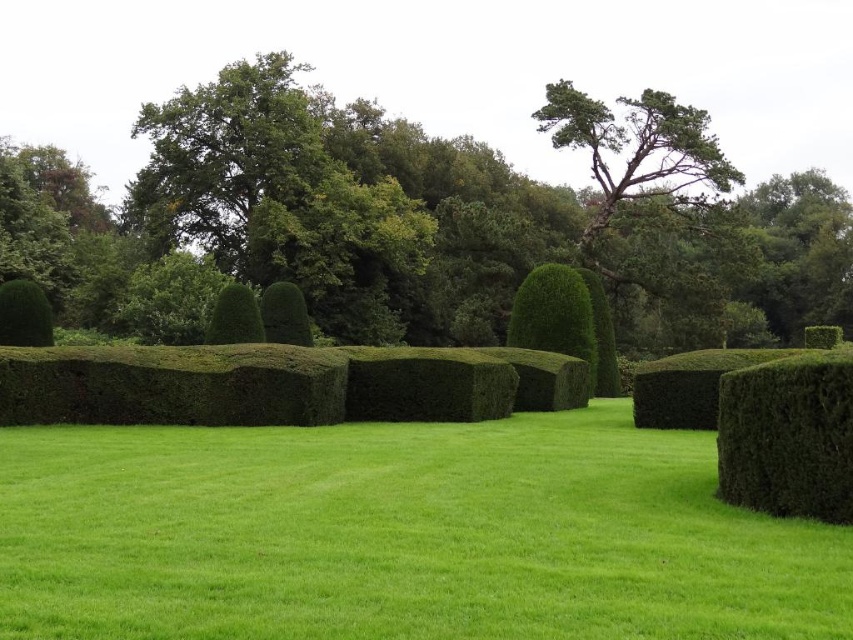
Describe the element at coordinates (399, 228) in the screenshot. I see `green leafy tree at center` at that location.

Is green leafy tree at center taller than dark green textured hedge at lower right?

Indeed, green leafy tree at center has a greater height compared to dark green textured hedge at lower right.

This screenshot has height=640, width=853. Identify the location of green leafy tree at center. (399, 228).

Between green smooth grass at center and green leafy shrub at left, which one is positioned lower?

green smooth grass at center is lower down.

Based on the photo, between green smooth grass at center and green leafy shrub at left, which one has more height?

green leafy shrub at left is taller.

Locate an element on the screen. This screenshot has height=640, width=853. green smooth grass at center is located at coordinates (401, 536).

Between point (287, 630) and point (846, 381), which one is positioned in front?

Positioned in front is point (287, 630).

Between green smooth grass at center and dark green textured hedge at lower right, which one appears on the left side from the viewer's perspective?

From the viewer's perspective, green smooth grass at center appears more on the left side.

Is point (12, 490) less distant than point (770, 378)?

No, it is not.

The image size is (853, 640). What are the coordinates of `green smooth grass at center` in the screenshot? It's located at (401, 536).